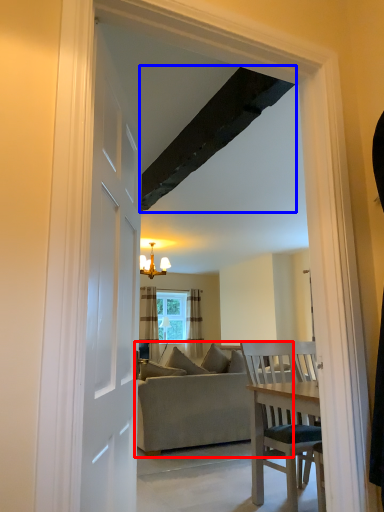
Question: Which object appears closest to the camera in this image, studio couch (highlighted by a red box) or exhaust hood (highlighted by a blue box)?

Choices:
 (A) studio couch
 (B) exhaust hood

Answer: (B)